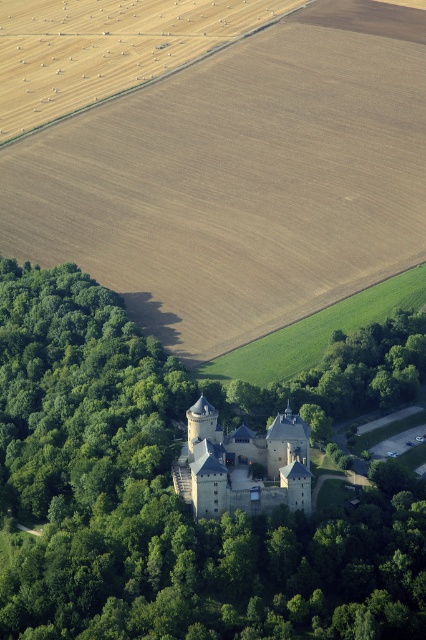
Between point (374, 544) and point (278, 496), which one is positioned behind?

Point (278, 496)

Between green leafy trees at center and stone medieval castle at center, which one has less height?

Standing shorter between the two is stone medieval castle at center.

Find the location of a particular element. This screenshot has width=426, height=640. green leafy trees at center is located at coordinates (164, 497).

Locate an element on the screen. The width and height of the screenshot is (426, 640). green leafy trees at center is located at coordinates (164, 497).